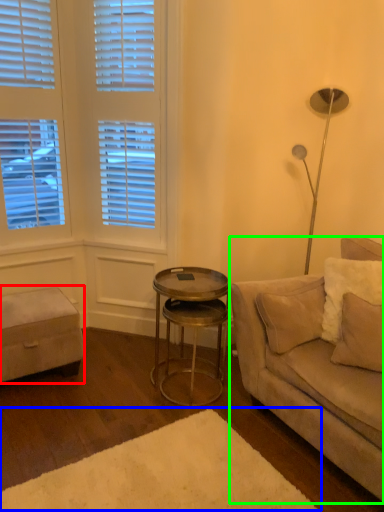
Question: Which object is the farthest from music stool (highlighted by a red box)? Choose among these: plain (highlighted by a blue box) or studio couch (highlighted by a green box).

Choices:
 (A) plain
 (B) studio couch

Answer: (B)